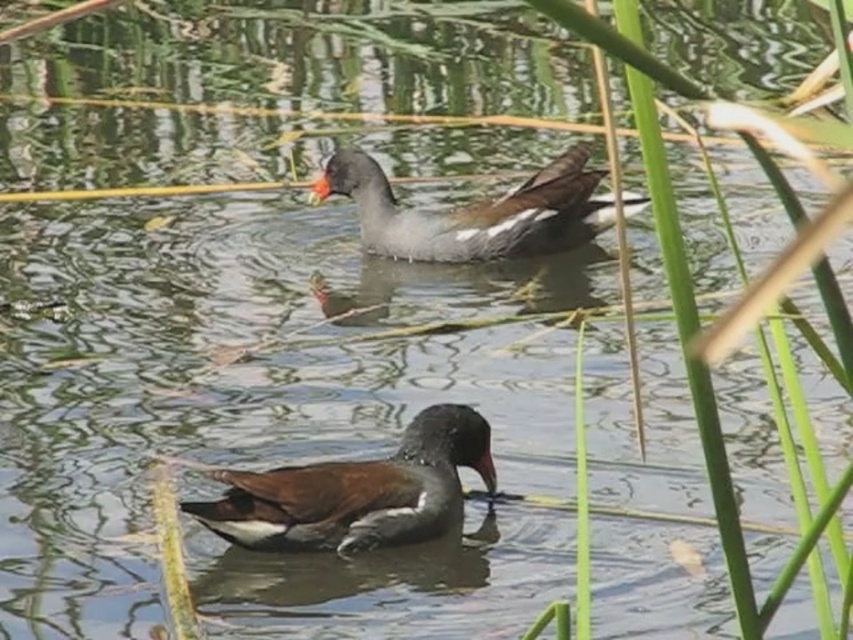
Is dark gray matte duck at center smaller than gray matte duck at upper center?

Yes, dark gray matte duck at center is smaller than gray matte duck at upper center.

In the scene shown: Does dark gray matte duck at center have a greater height compared to gray matte duck at upper center?

Incorrect, dark gray matte duck at center's height is not larger of gray matte duck at upper center's.

Is point (375, 531) closer to viewer compared to point (596, 216)?

Yes, it is in front of point (596, 216).

Where is `dark gray matte duck at center`? The height and width of the screenshot is (640, 853). dark gray matte duck at center is located at coordinates (357, 492).